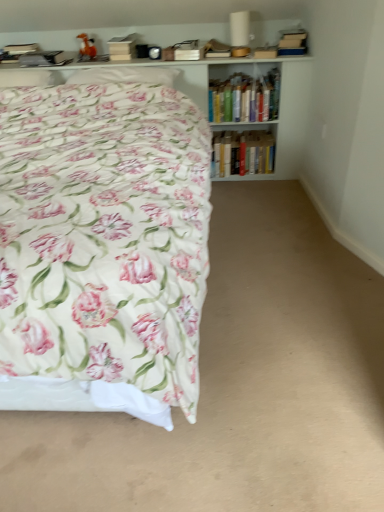
Question: Looking at the image, does floral fabric bed at left seem bigger or smaller compared to hardcover books at upper right, which appears as the first book when viewed from the top?

Choices:
 (A) big
 (B) small

Answer: (A)

Question: Considering the positions of floral fabric bed at left and hardcover books at upper right, which appears as the first book when viewed from the top, in the image, is floral fabric bed at left wider or thinner than hardcover books at upper right, which appears as the first book when viewed from the top,?

Choices:
 (A) wide
 (B) thin

Answer: (A)

Question: Which of these objects is positioned farthest from the hardcover books at upper right, placed as the second book when sorted from bottom to top?

Choices:
 (A) white glossy bookcase at upper center
 (B) hardcover books at center, marked as the first book in a bottom-to-top arrangement
 (C) floral fabric bed at left
 (D) white soft pillow at upper left, the 2th pillow when ordered from left to right
 (E) white soft pillow at upper left, the second pillow in the right-to-left sequence

Answer: (E)

Question: Which object is the closest to the white soft pillow at upper left, the 1th pillow from the right?

Choices:
 (A) hardcover books at upper right, placed as the second book when sorted from bottom to top
 (B) floral fabric bed at left
 (C) hardcover books at center, which is the 2th book in top-to-bottom order
 (D) white glossy bookcase at upper center
 (E) white soft pillow at upper left, the second pillow in the right-to-left sequence

Answer: (E)